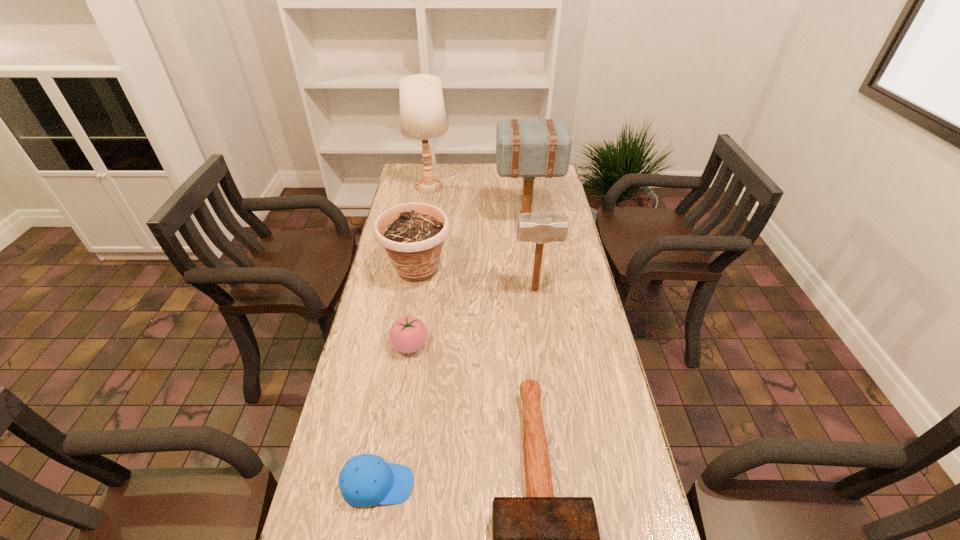
Locate an element on the screen. vacant space that is in between the tomato and the flowerpot is located at coordinates (414, 307).

Where is `unoccupied area between the second farthest object and the fifth farthest object`? This screenshot has height=540, width=960. unoccupied area between the second farthest object and the fifth farthest object is located at coordinates (468, 282).

Locate an element on the screen. Image resolution: width=960 pixels, height=540 pixels. vacant space that is in between the second farthest mallet and the cap is located at coordinates (456, 387).

Find the location of a particular element. the closest object to the second tallest mallet is located at coordinates (413, 234).

The image size is (960, 540). I want to click on object that is the fifth closest one to the cap, so click(x=528, y=149).

Where is `the second closest mallet to the tallest object`? The image size is (960, 540). the second closest mallet to the tallest object is located at coordinates (541, 227).

You are a GUI agent. You are given a task and a screenshot of the screen. Output one action in this format:
    pyautogui.click(x=<x>, y=<y>)
    Task: Click on the mallet that is the second nearest to the tallest mallet
    Image resolution: width=960 pixels, height=540 pixels.
    Given the screenshot: What is the action you would take?
    pyautogui.click(x=540, y=539)

You are a GUI agent. You are given a task and a screenshot of the screen. Output one action in this format:
    pyautogui.click(x=<x>, y=<y>)
    Task: Click on the vacant position in the image that satisfies the following two spatial constraints: 1. on the striking surface of the farthest mallet; 2. on the front side of the fourth shortest object
    
    Given the screenshot: What is the action you would take?
    pyautogui.click(x=533, y=269)